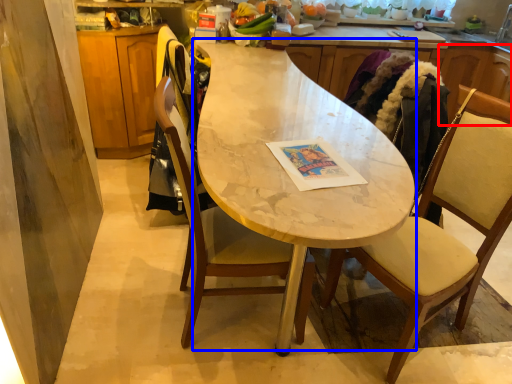
Question: Among these objects, which one is nearest to the camera, cabinetry (highlighted by a red box) or round table (highlighted by a blue box)?

Choices:
 (A) cabinetry
 (B) round table

Answer: (B)